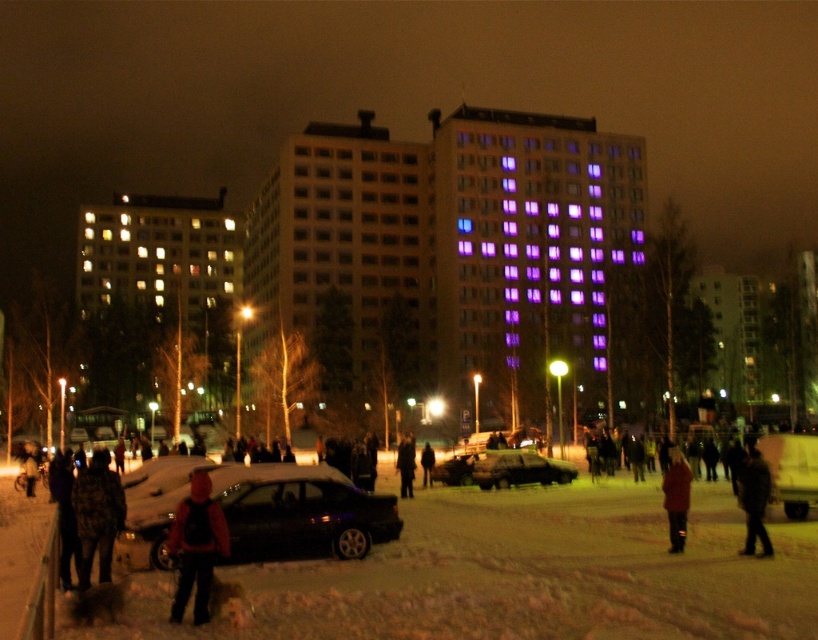
Question: Does matte red jacket at lower left have a larger size compared to matte black car at center?

Choices:
 (A) yes
 (B) no

Answer: (B)

Question: Is matte red jacket at lower left to the right of dark brown leather jacket at center from the viewer's perspective?

Choices:
 (A) no
 (B) yes

Answer: (A)

Question: Estimate the real-world distances between objects in this image. Which object is closer to the matte red jacket at lower left?

Choices:
 (A) camouflage jacket at lower left
 (B) matte black car at center
 (C) dark brown leather jacket at lower right
 (D) dark brown leather jacket at center

Answer: (A)

Question: Among these points, which one is farthest from the camera?

Choices:
 (A) (762, 508)
 (B) (135, 513)
 (C) (429, 477)
 (D) (677, 481)

Answer: (C)

Question: Is camouflage jacket at lower left positioned before dark gray jacket at center?

Choices:
 (A) no
 (B) yes

Answer: (B)

Question: Which point is closer to the camera taking this photo?

Choices:
 (A) (425, 460)
 (B) (174, 518)
 (C) (93, 509)

Answer: (B)